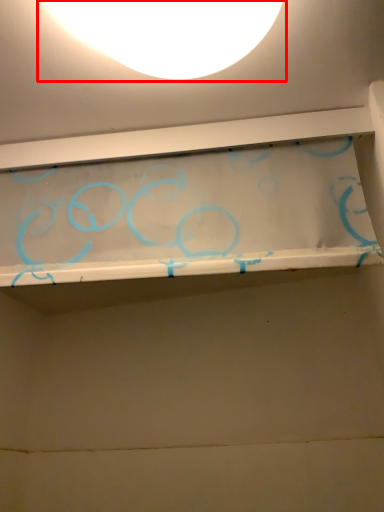
Question: Where is lamp (annotated by the red box) located in relation to shelf in the image?

Choices:
 (A) left
 (B) right

Answer: (B)